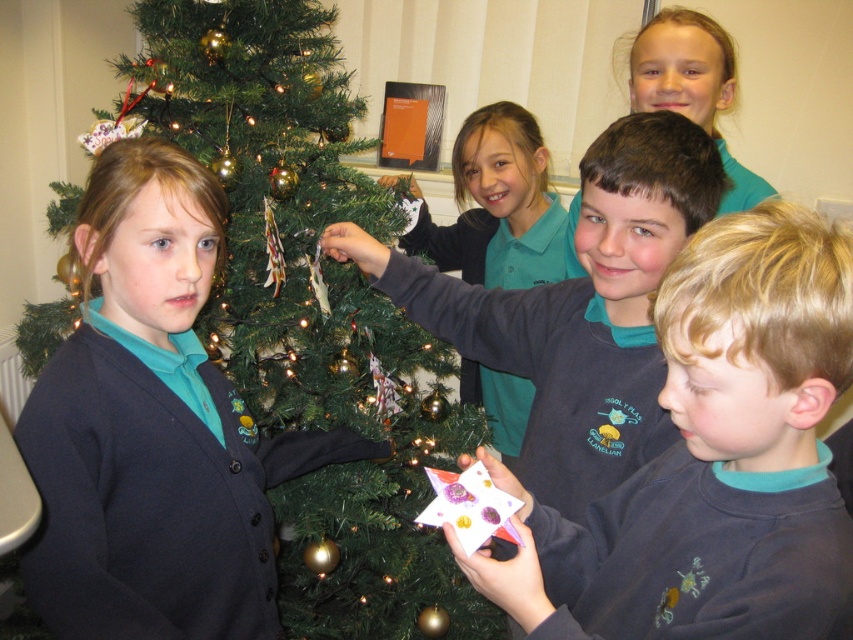
Can you confirm if matte gray sweater at center is shorter than teal fabric shirt at upper center?

Incorrect, matte gray sweater at center's height does not fall short of teal fabric shirt at upper center's.

Who is more forward, (592, 209) or (651, 19)?

Point (592, 209) is in front.

Where is `matte gray sweater at center`? This screenshot has height=640, width=853. matte gray sweater at center is located at coordinates (577, 308).

Can you confirm if dark blue sweatshirt at center is positioned to the left of matte gray sweater at center?

Incorrect, dark blue sweatshirt at center is not on the left side of matte gray sweater at center.

Is point (802, 337) in front of point (693, 228)?

Yes, it is.

What are the coordinates of `dark blue sweatshirt at center` in the screenshot? It's located at (712, 460).

Is dark blue sweatshirt at center bigger than teal fabric shirt at upper center?

Yes, dark blue sweatshirt at center is bigger than teal fabric shirt at upper center.

The image size is (853, 640). Describe the element at coordinates (712, 460) in the screenshot. I see `dark blue sweatshirt at center` at that location.

Does point (618, 536) come behind point (728, 84)?

No.

Find the location of a particular element. This screenshot has height=640, width=853. dark blue sweatshirt at center is located at coordinates (712, 460).